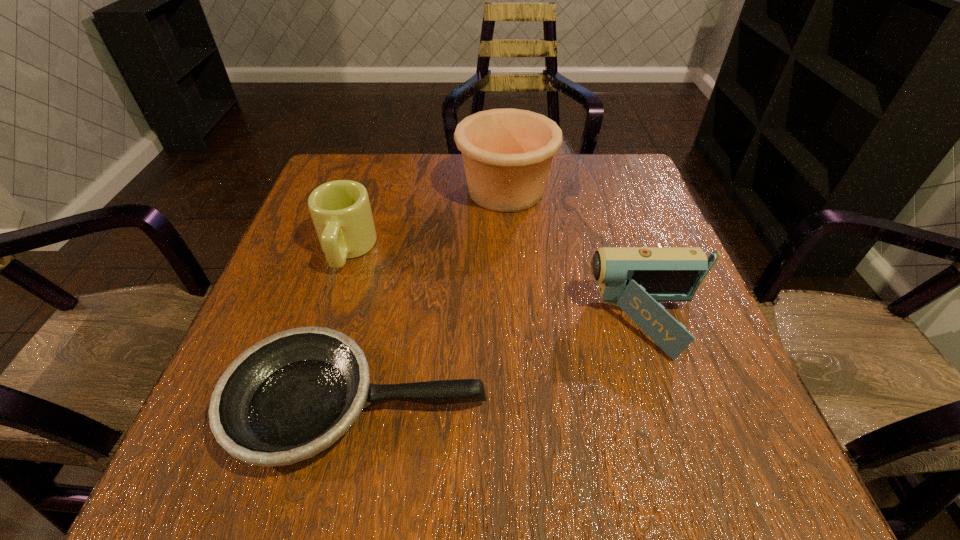
This screenshot has width=960, height=540. I want to click on pottery, so click(507, 153).

This screenshot has height=540, width=960. I want to click on the farthest object, so click(x=507, y=153).

This screenshot has height=540, width=960. Identify the location of the rightmost object. (635, 279).

Image resolution: width=960 pixels, height=540 pixels. Identify the location of the second farthest object. (340, 210).

Image resolution: width=960 pixels, height=540 pixels. I want to click on frying pan, so click(x=288, y=397).

Identify the location of blank space located on the front of the tallest object. The width and height of the screenshot is (960, 540). (515, 311).

What are the coordinates of `vacant space located 0.300m on the side of the camcorder with the flip-out screen` in the screenshot? It's located at (428, 324).

The width and height of the screenshot is (960, 540). In order to click on free region located 0.300m on the side of the camcorder with the flip-out screen in this screenshot , I will do `click(428, 324)`.

Find the location of a particular element. vacant region located 0.340m on the side of the camcorder with the flip-out screen is located at coordinates [407, 324].

I want to click on vacant space located 0.360m with the handle on the side of the mug, so click(x=283, y=448).